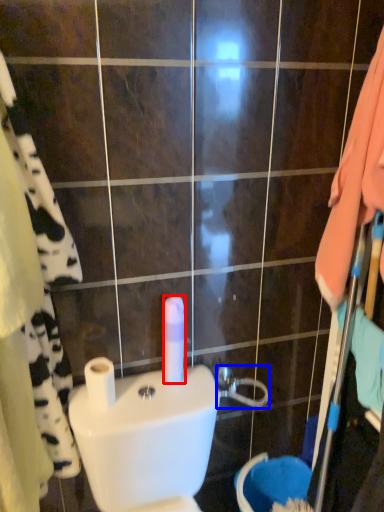
Question: Which object is further to the camera taking this photo, toilet paper (highlighted by a red box) or shower (highlighted by a blue box)?

Choices:
 (A) toilet paper
 (B) shower

Answer: (B)